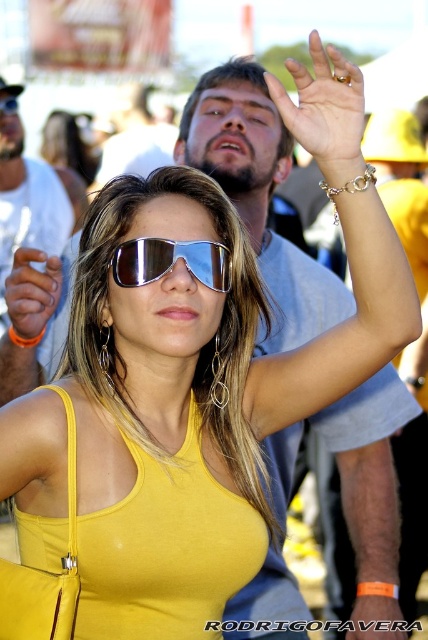
Based on the photo, you are a photographer trying to capture a clear shot of the sunglasses at center and the matte black sunglasses at upper center. Which pair of sunglasses is taller in the image?

The matte black sunglasses at upper center is taller than the sunglasses at center.

You are a photographer trying to capture the perfect shot of the lively outdoor scene. You notice two points in the image at coordinates point (x=139, y=237) and point (x=8, y=112). Based on their positions, which point is closer to the camera?

Point (x=139, y=237) is closer to the camera than point (x=8, y=112).

You are a photographer adjusting your camera settings. You notice two pairs of sunglasses in the frame. The first is the sunglasses at center, and the second is the matte black sunglasses at upper center. Which pair is closer to the camera?

The sunglasses at center is positioned under the matte black sunglasses at upper center, meaning the matte black sunglasses at upper center is closer to the camera.